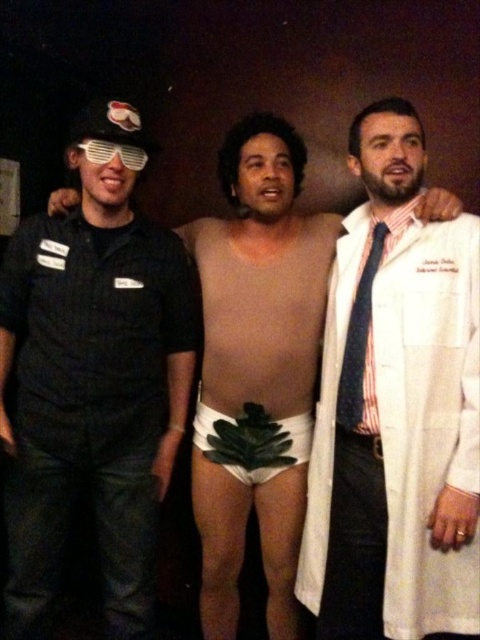
You are a photographer at a formal event. You need to capture a candid shot of the person wearing the white lab coat at right without including the white matte underwear at center in the frame. How should you adjust your camera angle?

To avoid including the white matte underwear at center, you should position your camera to the right side of the scene so that the white lab coat at right is framed while the white matte underwear at center is out of the shot.

You are a photographer at a themed party and need to capture a candid shot of the white matte underwear at center and the white lab coat at right. Based on their positions, which object is positioned higher in the frame?

The white matte underwear at center is positioned higher in the frame than the white lab coat at right.